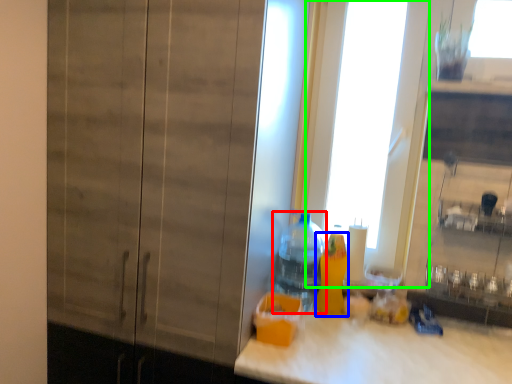
Question: Considering the real-world distances, which object is farthest from bottle (highlighted by a red box)? bottle (highlighted by a blue box) or glass door (highlighted by a green box)?

Choices:
 (A) bottle
 (B) glass door

Answer: (B)